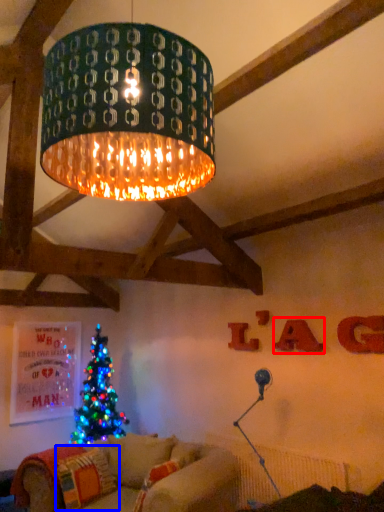
Question: Among these objects, which one is farthest to the camera, letter (highlighted by a red box) or pillow (highlighted by a blue box)?

Choices:
 (A) letter
 (B) pillow

Answer: (A)